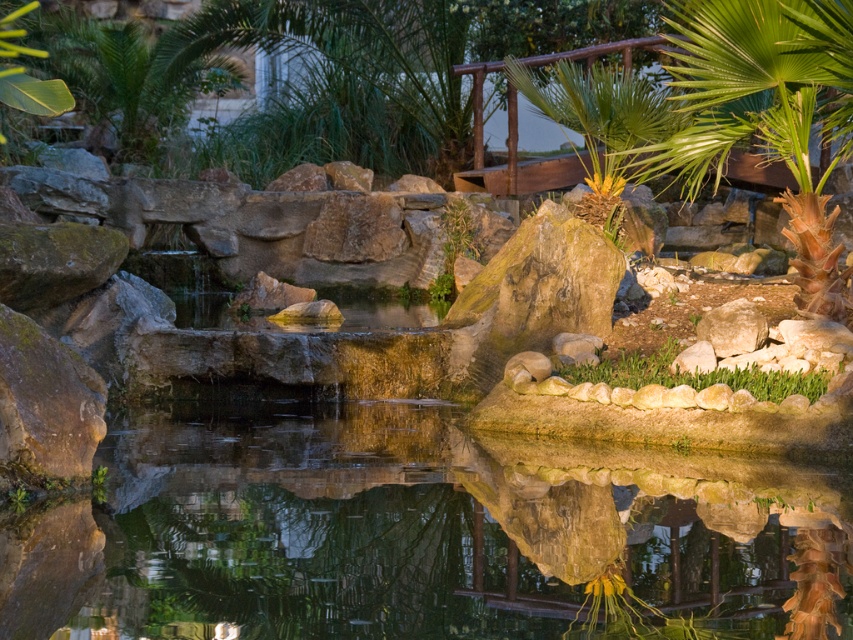
Question: Estimate the real-world distances between objects in this image. Which object is closer to the green grass at center?

Choices:
 (A) clear water at center
 (B) green leafy palm tree at upper right
 (C) green leafy palm tree at center
 (D) brown rough rock at center-right

Answer: (D)

Question: Is green grass at center smaller than brown rough rock at center-right?

Choices:
 (A) yes
 (B) no

Answer: (B)

Question: Is green leafy palm tree at upper left bigger than green grass at center?

Choices:
 (A) yes
 (B) no

Answer: (A)

Question: Can you confirm if green leafy palm tree at upper left is wider than brown rough rock at center-right?

Choices:
 (A) yes
 (B) no

Answer: (A)

Question: Based on their relative distances, which object is nearer to the clear water at center?

Choices:
 (A) green grass at center
 (B) brown rough rock at center-right
 (C) green leafy palm tree at upper left

Answer: (A)

Question: Based on their relative distances, which object is nearer to the brown rough rock at center-right?

Choices:
 (A) green leafy palm tree at upper left
 (B) clear water at center
 (C) green leafy palm tree at center
 (D) green grass at center

Answer: (D)